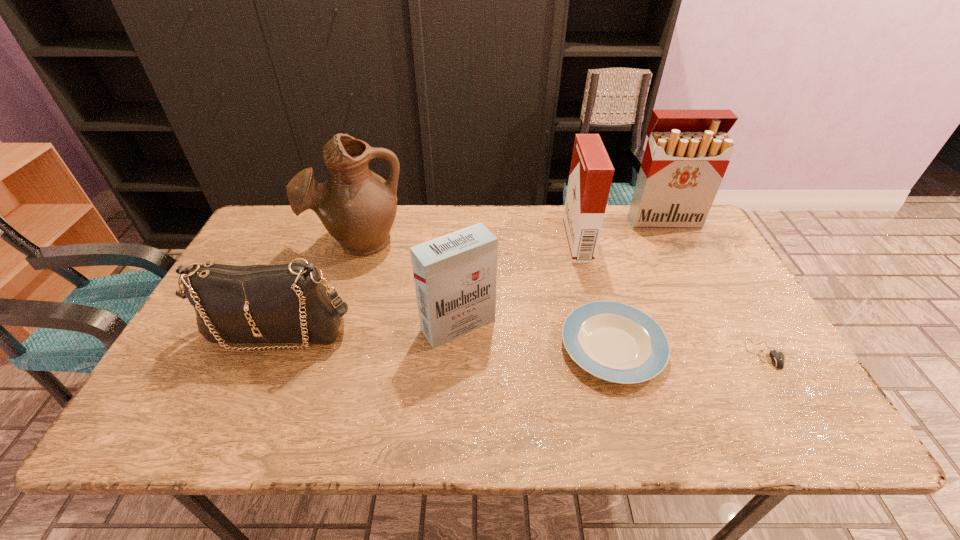
What are the coordinates of `computer mouse present at the right edge` in the screenshot? It's located at (777, 358).

I want to click on object positioned at the far right corner, so click(x=687, y=154).

I want to click on free space at the far edge of the desktop, so click(x=626, y=228).

This screenshot has width=960, height=540. In the image, there is a desktop. Identify the location of vacant space at the near edge. pyautogui.click(x=708, y=434).

Identify the location of free space at the right edge of the desktop. click(730, 327).

The width and height of the screenshot is (960, 540). I want to click on vacant region at the far left corner of the desktop, so click(285, 248).

The image size is (960, 540). I want to click on vacant space at the near left corner, so click(x=209, y=435).

You are a GUI agent. You are given a task and a screenshot of the screen. Output one action in this format:
    pyautogui.click(x=<x>, y=<y>)
    Task: Click on the unoccupied area between the second cigarette case from right to left and the plate
    This screenshot has width=960, height=540.
    Given the screenshot: What is the action you would take?
    pyautogui.click(x=595, y=294)

This screenshot has height=540, width=960. Identify the location of unoccupied position between the handbag and the computer mouse. (521, 342).

Where is `blank region between the rightmost cigarette case and the leftmost cigarette case`? blank region between the rightmost cigarette case and the leftmost cigarette case is located at coordinates (561, 273).